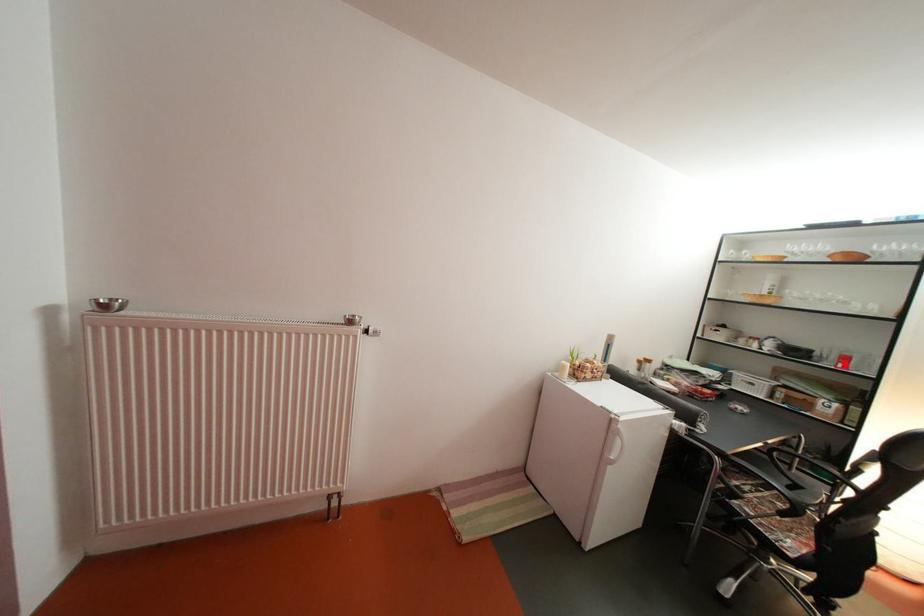
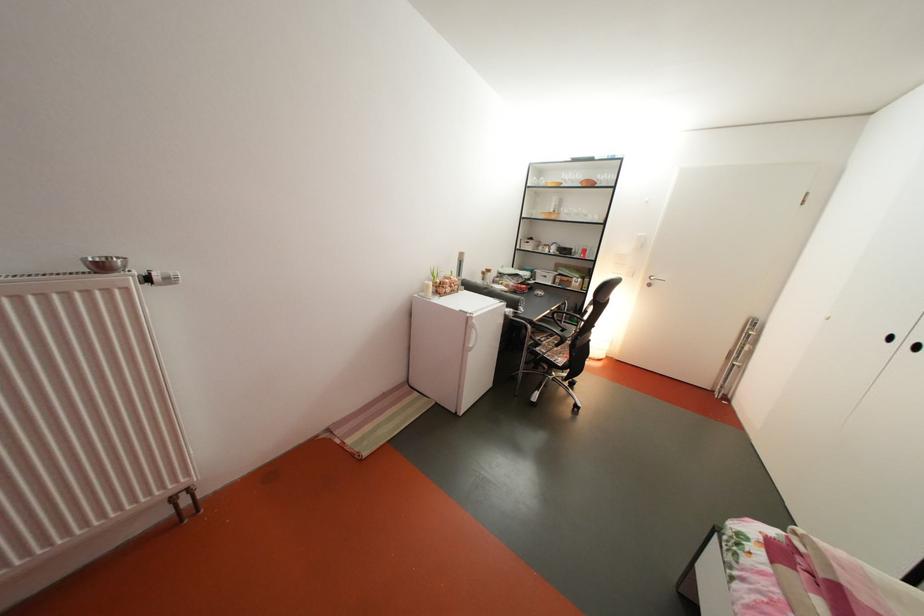
Question: A red point is marked in image1. In image2, is the corresponding 3D point closer to the camera or farther? Reply with the corresponding letter.

Choices:
 (A) The corresponding 3D point is closer.
 (B) The corresponding 3D point is farther.

Answer: (A)